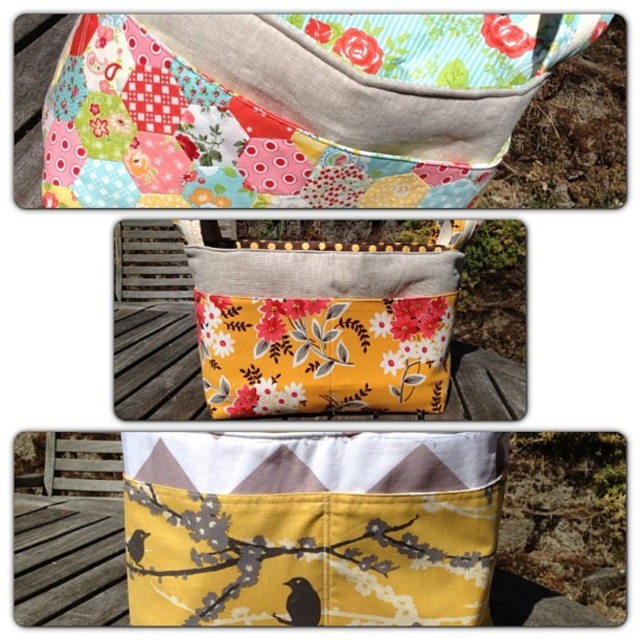
Consider the image. You are organizing a picnic basket and need to decide whether the yellow floral fabric pouch at center can hold the black matte bird at lower center. Based on their sizes, will the pouch be able to contain the bird?

The yellow floral fabric pouch at center is larger than the black matte bird at lower center, so yes, the pouch can hold the bird.

You are organizing a picnic and have a small bag that can only hold one item. If you need to choose between the floral patchwork fabric pouch at upper center and the black matte bird at lower left, which one can you fit without exceeding the bag size?

The black matte bird at lower left is smaller than the floral patchwork fabric pouch at upper center, so you can fit the black matte bird at lower left into your small bag without exceeding its size.

You are standing in front of the three fabric baskets. You see a black matte bird at lower center and a black matte bird at lower left. Which black matte bird is positioned to the right of the other?

The black matte bird at lower center is to the right of the black matte bird at lower left.